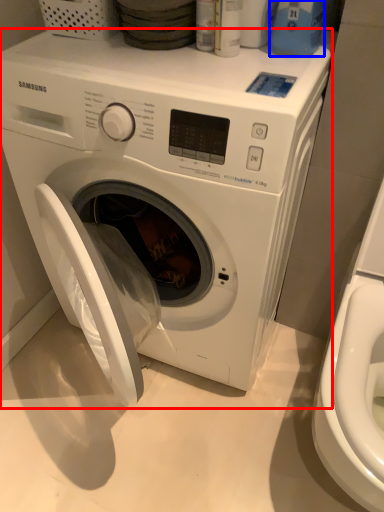
Question: Which of the following is the farthest to the observer, washing machine (highlighted by a red box) or cleaning product (highlighted by a blue box)?

Choices:
 (A) washing machine
 (B) cleaning product

Answer: (B)